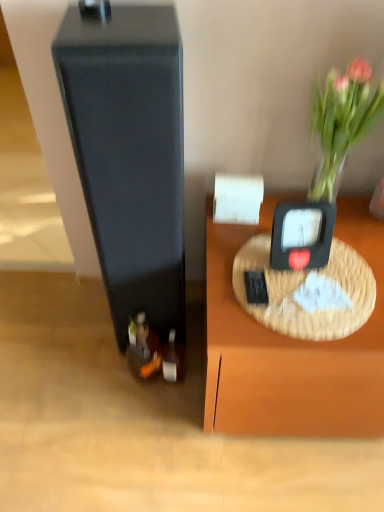
This screenshot has width=384, height=512. I want to click on blank space to the left of black plastic weight scale at upper right, so click(x=236, y=259).